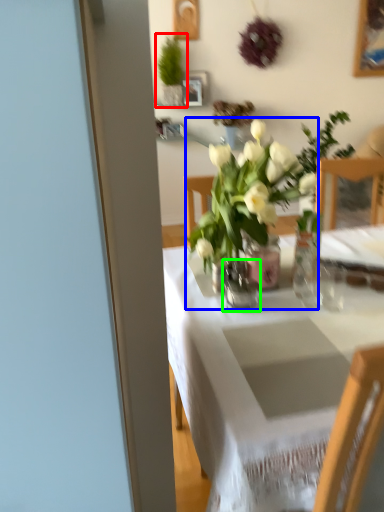
Question: Which is nearer to the houseplant (highlighted by a red box)? houseplant (highlighted by a blue box) or vase (highlighted by a green box).

Choices:
 (A) houseplant
 (B) vase

Answer: (A)